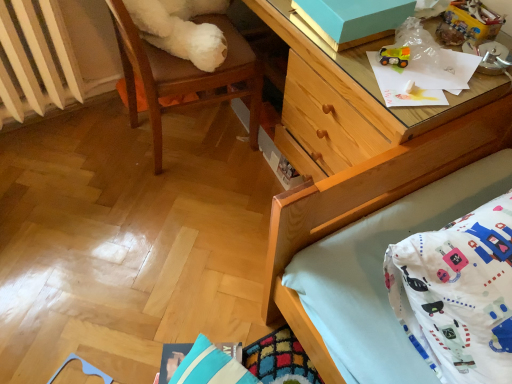
In order to click on vacant space that is to the left of rubberized yellow toy truck at upper right, the 1th toy from the bottom in this screenshot , I will do `click(349, 59)`.